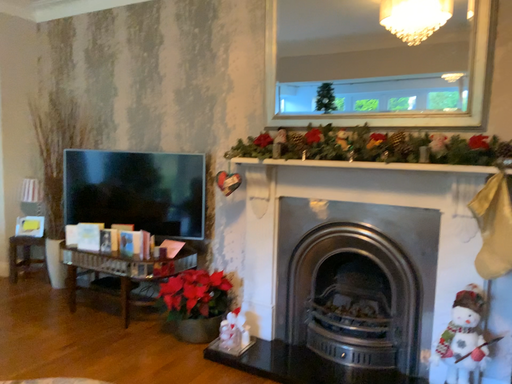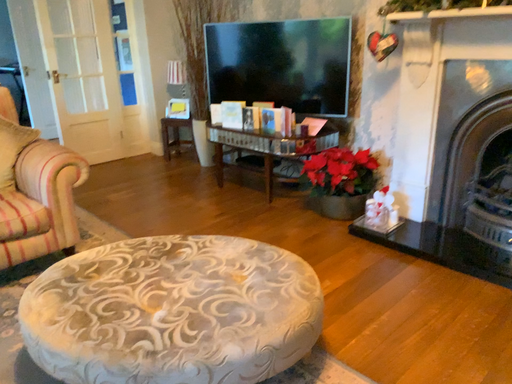
Question: How did the camera likely rotate when shooting the video?

Choices:
 (A) rotated downward
 (B) rotated upward

Answer: (A)